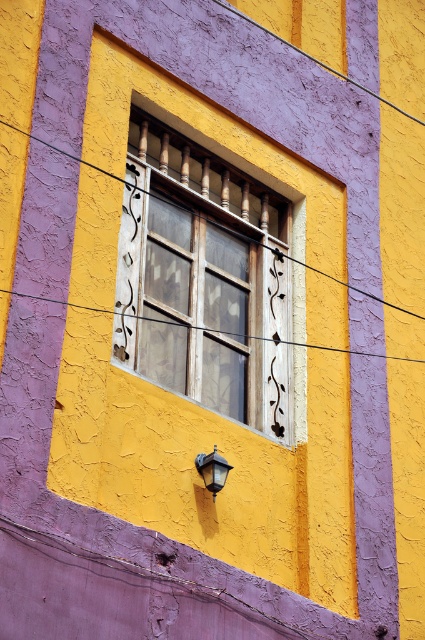
Question: Does transparent glass window at center appear over matte black lamp at lower center?

Choices:
 (A) no
 (B) yes

Answer: (B)

Question: From the image, what is the correct spatial relationship of transparent glass window at center in relation to matte black lamp at lower center?

Choices:
 (A) above
 (B) below

Answer: (A)

Question: Which of the following is the closest to the observer?

Choices:
 (A) matte black lamp at lower center
 (B) transparent glass window at center

Answer: (A)

Question: Which of the following is the closest to the observer?

Choices:
 (A) matte black lamp at lower center
 (B) transparent glass window at center

Answer: (A)

Question: Which of the following is the farthest from the observer?

Choices:
 (A) matte black lamp at lower center
 (B) transparent glass window at center

Answer: (B)

Question: Is transparent glass window at center below matte black lamp at lower center?

Choices:
 (A) yes
 (B) no

Answer: (B)